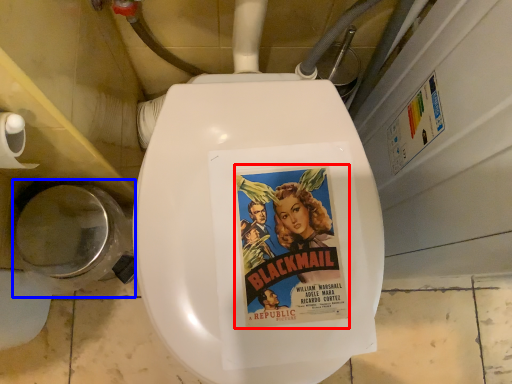
Question: Which object is closer to the camera taking this photo, fiction book (highlighted by a red box) or toilet bowl (highlighted by a blue box)?

Choices:
 (A) fiction book
 (B) toilet bowl

Answer: (A)